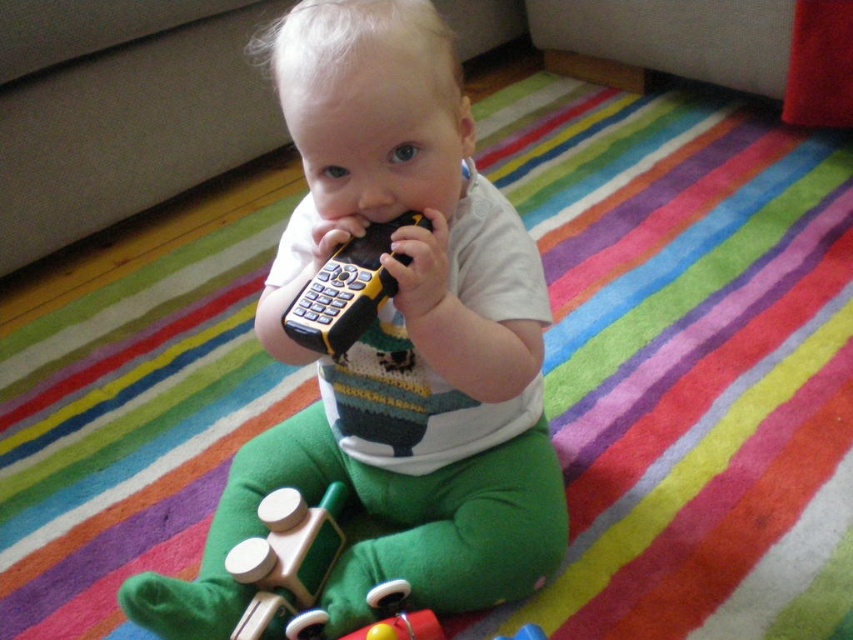
Which is below, wooden toy car at center or yellow plastic remote at center?

wooden toy car at center is lower down.

Is point (422, 540) closer to viewer compared to point (326, 294)?

No, it is behind (326, 294).

Image resolution: width=853 pixels, height=640 pixels. Identify the location of wooden toy car at center. (395, 340).

Can you confirm if wooden train at lower center is thinner than yellow plastic remote at center?

Yes.

Which of these two, wooden train at lower center or yellow plastic remote at center, stands shorter?

Standing shorter between the two is yellow plastic remote at center.

Which is in front, point (271, 556) or point (403, 214)?

Point (403, 214) is more forward.

The height and width of the screenshot is (640, 853). What are the coordinates of `wooden train at lower center` in the screenshot? It's located at (287, 563).

Looking at this image, does wooden toy car at center have a larger size compared to wooden train at lower center?

Correct, wooden toy car at center is larger in size than wooden train at lower center.

Can you confirm if wooden toy car at center is smaller than wooden train at lower center?

No, wooden toy car at center is not smaller than wooden train at lower center.

Identify the location of wooden toy car at center. click(395, 340).

The width and height of the screenshot is (853, 640). In order to click on wooden toy car at center in this screenshot , I will do `click(395, 340)`.